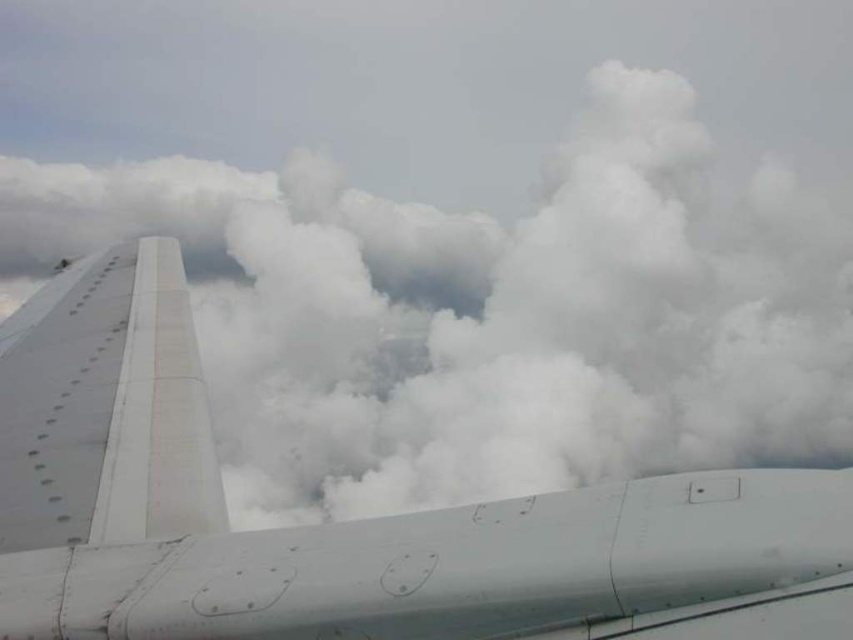
You are a passenger sitting in the aircraft and looking out the window. You see the white matte airplane wing at left and the white matte wing at left. Which one is closer to you?

The white matte airplane wing at left is closer to you because it is in front of the white matte wing at left.

You are a passenger sitting in the aircraft and looking out the window. You see the white matte airplane wing at left and the white matte wing at left. Which one is positioned more to the right side from your viewpoint?

The white matte airplane wing at left is positioned to the right of the white matte wing at left, so the white matte airplane wing at left is more to the right side from your viewpoint.